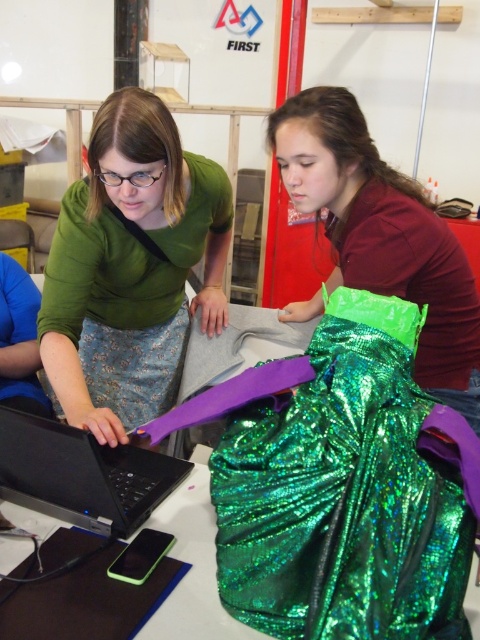
Question: Does black matte laptop at center have a smaller size compared to black plastic table at center?

Choices:
 (A) no
 (B) yes

Answer: (A)

Question: Which point appears farthest from the camera in this image?

Choices:
 (A) (48, 512)
 (B) (34, 522)

Answer: (A)

Question: Which point appears farthest from the camera in this image?

Choices:
 (A) (400, 529)
 (B) (184, 488)
 (C) (0, 480)

Answer: (B)

Question: Which point is closer to the camera?

Choices:
 (A) green sequined skirt at center
 (B) black plastic table at center
 (C) green sequined fabric at center
 (D) green sparkly skirt at center

Answer: (C)

Question: Can you confirm if green sparkly skirt at center is positioned above black plastic table at center?

Choices:
 (A) no
 (B) yes

Answer: (B)

Question: Does green sequined fabric at center have a smaller size compared to black matte laptop at center?

Choices:
 (A) yes
 (B) no

Answer: (B)